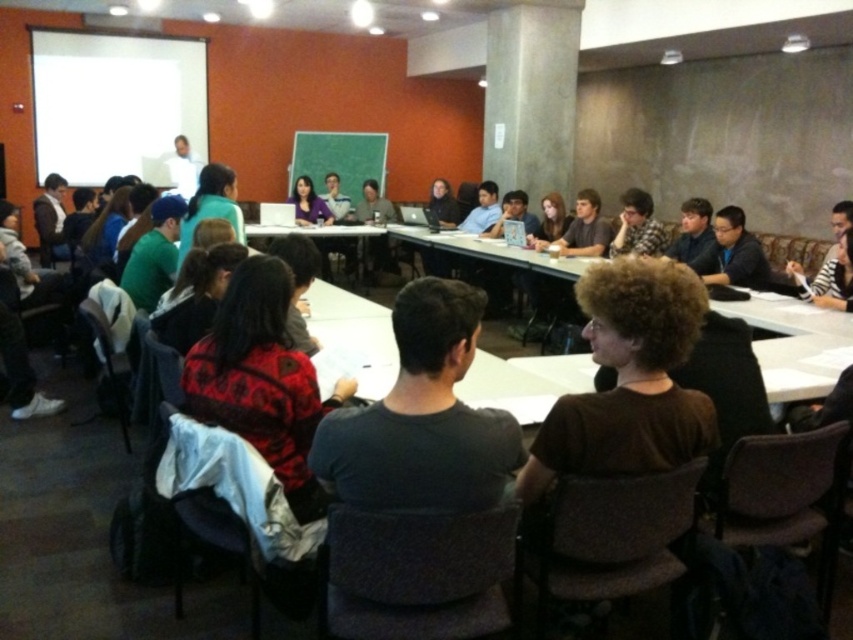
Is matte black shirt at center above white plastic table at center?

No.

Find the location of a particular element. matte black shirt at center is located at coordinates (637, 225).

Who is more distant from viewer, [633,205] or [378,232]?

The point [378,232] is behind.

This screenshot has height=640, width=853. Find the location of `matte black shirt at center`. matte black shirt at center is located at coordinates (637, 225).

How much distance is there between red sweater at center and matte purple shirt at center?

red sweater at center is 19.66 feet from matte purple shirt at center.

Can you confirm if red sweater at center is positioned below matte purple shirt at center?

Indeed, red sweater at center is positioned under matte purple shirt at center.

Which is in front, point (318, 403) or point (302, 208)?

Point (318, 403) is in front.

I want to click on red sweater at center, so click(262, 380).

Can you confirm if red sweater at center is taller than matte black shirt at center?

Yes.

Can you confirm if red sweater at center is positioned below matte black shirt at center?

Indeed, red sweater at center is positioned under matte black shirt at center.

Is point (256, 396) less distant than point (650, 250)?

Yes, it is.

This screenshot has width=853, height=640. I want to click on red sweater at center, so click(x=262, y=380).